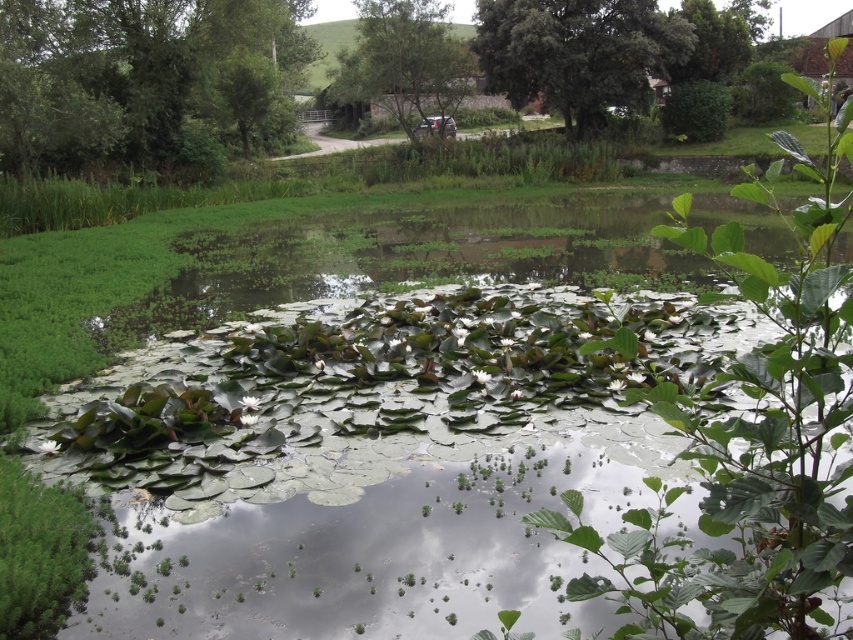
You are standing on the dirt path near the pond and want to walk towards the barn. There are two points marked on your map at coordinates point [525,33] and point [410,12]. Which point should you head towards first to stay on the path leading to the barn?

You should head towards point [525,33] first because it is in front of point [410,12] along the path leading to the barn.

You are standing at the edge of the pond and notice two green leafy trees in the background. Which tree is closer to you, the green leafy tree at upper left or the green leafy tree at upper right?

The green leafy tree at upper left is closer to you because it is positioned over the green leafy tree at upper right, indicating it is in the foreground.